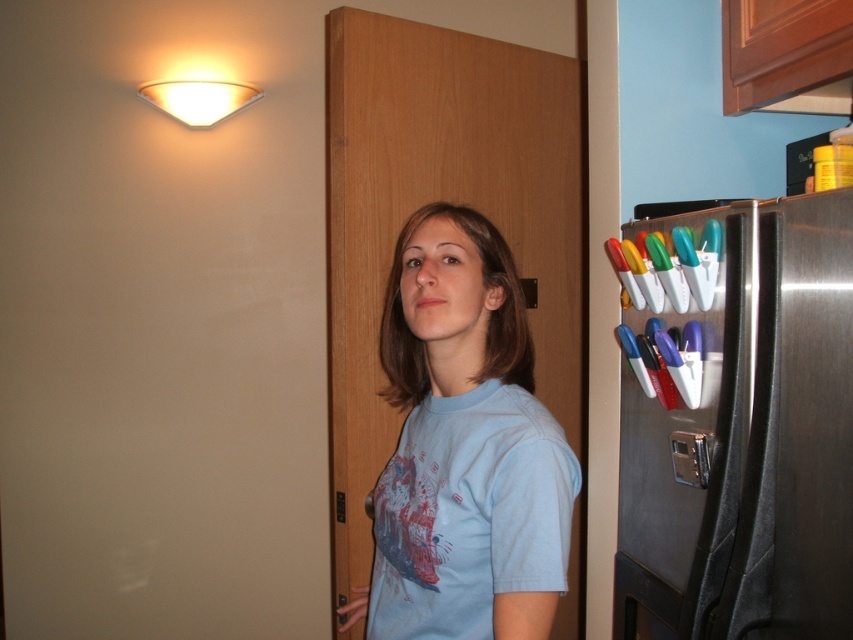
You are a home inspector checking the kitchen layout. The stainless steel refrigerator at right and the light blue cotton shirt at center are both in your view. Which object is physically closer to you?

The stainless steel refrigerator at right is smaller than the light blue cotton shirt at center, which suggests that the refrigerator is farther away since smaller size often indicates distance. Therefore, the light blue cotton shirt at center is closer to you.

You are a home inspector assessing the kitchen layout. You need to determine if the stainless steel refrigerator at right can fit through the doorway without removing any parts. The doorway is the same width as the light blue cotton shirt at center. Can the refrigerator pass through?

The stainless steel refrigerator at right has a lesser width compared to the light blue cotton shirt at center, so it can fit through the doorway since the refrigerator is narrower than the doorway.

Based on the photo, you are standing in the kitchen and want to locate the point at coordinates (744, 429). Based on the scene description, where exactly would this point be located?

The point at coordinates (744, 429) is on the stainless steel refrigerator at right.